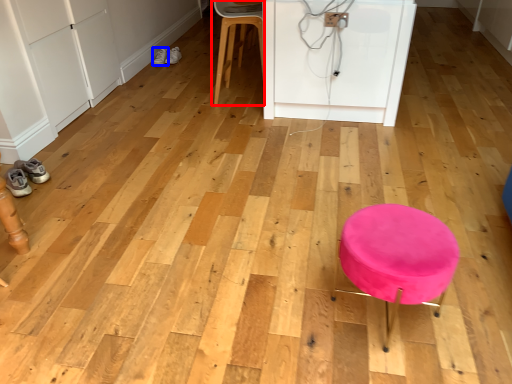
Question: Which of the following is the farthest to the observer, chair (highlighted by a red box) or footwear (highlighted by a blue box)?

Choices:
 (A) chair
 (B) footwear

Answer: (B)